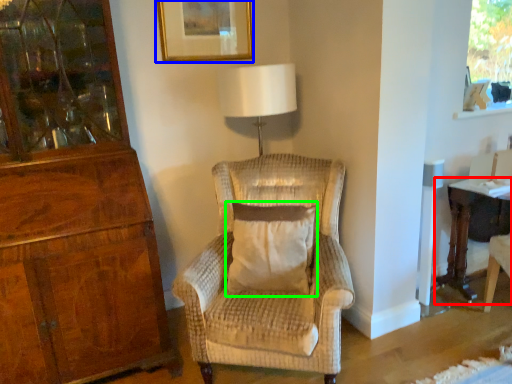
Question: Which object is the farthest from desk (highlighted by a red box)? Choose among these: picture frame (highlighted by a blue box) or pillow (highlighted by a green box).

Choices:
 (A) picture frame
 (B) pillow

Answer: (A)